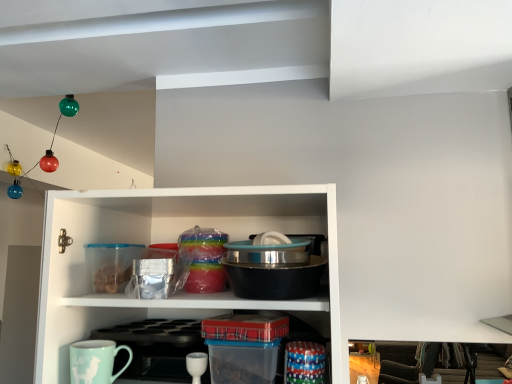
Where is `white glossy cup at lower center`? The height and width of the screenshot is (384, 512). white glossy cup at lower center is located at coordinates (196, 365).

At what (x,y) coordinates should I click in order to perform the action: click on stainless steel bowl at center. Please return your answer as a coordinate pair (x, y). This screenshot has height=384, width=512. Looking at the image, I should click on (273, 270).

From a real-world perspective, is stainless steel bowl at center positioned over white glossy cup at lower center based on gravity?

Yes, from a real-world perspective, stainless steel bowl at center is on top of white glossy cup at lower center.

Locate an element on the screen. The width and height of the screenshot is (512, 384). appliance above the white glossy cup at lower center (from a real-world perspective) is located at coordinates (273, 270).

Is stainless steel bowl at center positioned beyond the bounds of white glossy cup at lower center?

stainless steel bowl at center lies outside white glossy cup at lower center's area.

Would you consider stainless steel bowl at center to be distant from white glossy cup at lower center?

No, there isn't a large distance between stainless steel bowl at center and white glossy cup at lower center.

From a real-world perspective, which is physically below, white glossy cup at lower center or teal glossy mug at lower left?

From a 3D spatial view, white glossy cup at lower center is below.

Does white glossy cup at lower center have a greater height compared to teal glossy mug at lower left?

No, white glossy cup at lower center is not taller than teal glossy mug at lower left.

Which object is wider, white glossy cup at lower center or teal glossy mug at lower left?

With larger width is white glossy cup at lower center.

From the image's perspective, which is above, white glossy cup at lower center or teal glossy mug at lower left?

teal glossy mug at lower left.

Does point (195, 382) come in front of point (320, 267)?

Yes, point (195, 382) is closer to viewer.

Which object is further away from the camera taking this photo, white glossy cup at lower center or stainless steel bowl at center?

white glossy cup at lower center is behind.

From the picture: How many degrees apart are the facing directions of white glossy cup at lower center and stainless steel bowl at center?

There is a 4.77-degree angle between the facing directions of white glossy cup at lower center and stainless steel bowl at center.

Which of these two, white glossy cup at lower center or stainless steel bowl at center, is bigger?

Bigger between the two is stainless steel bowl at center.

Does teal glossy mug at lower left come behind stainless steel bowl at center?

Yes, teal glossy mug at lower left is further from the viewer.

Find the location of `appliance in front of the teal glossy mug at lower left`. appliance in front of the teal glossy mug at lower left is located at coordinates (273, 270).

Can you confirm if teal glossy mug at lower left is positioned to the right of stainless steel bowl at center?

In fact, teal glossy mug at lower left is to the left of stainless steel bowl at center.

Is the surface of teal glossy mug at lower left in direct contact with stainless steel bowl at center?

No, teal glossy mug at lower left is not beside stainless steel bowl at center.

Which is nearer, (128, 353) or (195, 378)?

Point (128, 353) is farther from the camera than point (195, 378).

Would you consider teal glossy mug at lower left to be distant from white glossy cup at lower center?

No, teal glossy mug at lower left is not far away from white glossy cup at lower center.

Is teal glossy mug at lower left oriented towards white glossy cup at lower center?

No, teal glossy mug at lower left does not turn towards white glossy cup at lower center.

Considering the sizes of objects stainless steel bowl at center and teal glossy mug at lower left in the image provided, who is wider, stainless steel bowl at center or teal glossy mug at lower left?

stainless steel bowl at center.

Measure the distance between stainless steel bowl at center and teal glossy mug at lower left.

stainless steel bowl at center is 14.52 inches away from teal glossy mug at lower left.

From the image's perspective, is stainless steel bowl at center on teal glossy mug at lower left?

Yes.

Is stainless steel bowl at center situated inside teal glossy mug at lower left or outside?

stainless steel bowl at center is located beyond the bounds of teal glossy mug at lower left.

At what (x,y) coordinates should I click in order to perform the action: click on tableware that appears below the stainless steel bowl at center (from the image's perspective). Please return your answer as a coordinate pair (x, y). The width and height of the screenshot is (512, 384). Looking at the image, I should click on (196, 365).

Find the location of a particular element. The width and height of the screenshot is (512, 384). tableware behind the teal glossy mug at lower left is located at coordinates (196, 365).

In the scene shown: Which object lies nearer to the anchor point stainless steel bowl at center, teal glossy mug at lower left or white glossy cup at lower center?

white glossy cup at lower center is closer to stainless steel bowl at center.

Which object lies further to the anchor point white glossy cup at lower center, stainless steel bowl at center or teal glossy mug at lower left?

stainless steel bowl at center is further to white glossy cup at lower center.

Based on their spatial positions, is white glossy cup at lower center or stainless steel bowl at center closer to teal glossy mug at lower left?

Among the two, white glossy cup at lower center is located nearer to teal glossy mug at lower left.

Estimate the real-world distances between objects in this image. Which object is further from stainless steel bowl at center, white glossy cup at lower center or teal glossy mug at lower left?

teal glossy mug at lower left.

Estimate the real-world distances between objects in this image. Which object is further from teal glossy mug at lower left, stainless steel bowl at center or white glossy cup at lower center?

stainless steel bowl at center is positioned further to the anchor teal glossy mug at lower left.

Estimate the real-world distances between objects in this image. Which object is closer to white glossy cup at lower center, teal glossy mug at lower left or stainless steel bowl at center?

teal glossy mug at lower left.

Locate an element on the screen. The image size is (512, 384). tableware situated between teal glossy mug at lower left and stainless steel bowl at center from left to right is located at coordinates (196, 365).